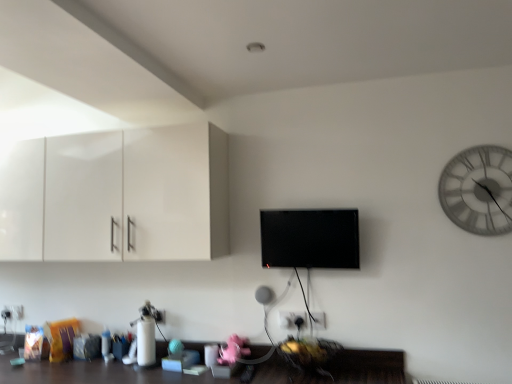
Describe the element at coordinates (310, 238) in the screenshot. The image size is (512, 384). I see `black glossy flat screen tv at center` at that location.

You are a GUI agent. You are given a task and a screenshot of the screen. Output one action in this format:
    pyautogui.click(x=<x>, y=<y>)
    Task: Click on the white glass clock at upper right
    The width and height of the screenshot is (512, 384).
    Given the screenshot: What is the action you would take?
    pyautogui.click(x=479, y=190)

Measure the distance between white plastic electric outlet at lower center, which is counted as the 1th electric outlet, starting from the top, and camera.

white plastic electric outlet at lower center, which is counted as the 1th electric outlet, starting from the top, and camera are 2.29 meters apart.

Where is `white plastic electric outlet at lower left, placed as the 2th electric outlet when sorted from front to back`? white plastic electric outlet at lower left, placed as the 2th electric outlet when sorted from front to back is located at coordinates (13, 312).

Where is `white glossy cabinet at upper left`? white glossy cabinet at upper left is located at coordinates (117, 196).

Where is `black glossy flat screen tv at center`? black glossy flat screen tv at center is located at coordinates (310, 238).

Which of these two, white plastic electric outlet at lower left, which appears as the first electric outlet when viewed from the left, or black glossy flat screen tv at center, stands shorter?

white plastic electric outlet at lower left, which appears as the first electric outlet when viewed from the left.

Is white plastic electric outlet at lower left, acting as the second electric outlet starting from the top, thinner than black glossy flat screen tv at center?

Yes.

From the image's perspective, which one is positioned higher, white plastic electric outlet at lower left, placed as the 2th electric outlet when sorted from front to back, or black glossy flat screen tv at center?

black glossy flat screen tv at center, from the image's perspective.

In terms of size, does white plastic electric outlet at lower center, which is counted as the 1th electric outlet, starting from the top, appear bigger or smaller than black glossy flat screen tv at center?

Clearly, white plastic electric outlet at lower center, which is counted as the 1th electric outlet, starting from the top, is smaller in size than black glossy flat screen tv at center.

Is black glossy flat screen tv at center completely or partially inside white plastic electric outlet at lower center, which is the 2th electric outlet in left-to-right order?

No, black glossy flat screen tv at center is located outside of white plastic electric outlet at lower center, which is the 2th electric outlet in left-to-right order.

Is white plastic electric outlet at lower center, the first electric outlet when ordered from right to left, oriented away from black glossy flat screen tv at center?

No, white plastic electric outlet at lower center, the first electric outlet when ordered from right to left, is not facing the opposite direction of black glossy flat screen tv at center.

In terms of width, does white plastic electric outlet at lower center, the first electric outlet when ordered from right to left, look wider or thinner when compared to black glossy flat screen tv at center?

Considering their sizes, white plastic electric outlet at lower center, the first electric outlet when ordered from right to left, looks slimmer than black glossy flat screen tv at center.

Which is behind, point (302, 231) or point (9, 306)?

The point (9, 306) is behind.

Is black glossy flat screen tv at center next to white plastic electric outlet at lower left, which appears as the first electric outlet when viewed from the left?

No, black glossy flat screen tv at center is not beside white plastic electric outlet at lower left, which appears as the first electric outlet when viewed from the left.

Which is behind, black glossy flat screen tv at center or white plastic electric outlet at lower left, which appears as the first electric outlet when viewed from the left?

white plastic electric outlet at lower left, which appears as the first electric outlet when viewed from the left, is more distant.

From the image's perspective, which one is positioned lower, black glossy flat screen tv at center or white plastic electric outlet at lower left, acting as the second electric outlet starting from the top?

From the image's view, white plastic electric outlet at lower left, acting as the second electric outlet starting from the top, is below.

From a real-world perspective, is white plastic electric outlet at lower center, placed as the second electric outlet when sorted from back to front, located higher than white glossy cabinet at upper left?

No.

In the scene shown: From the image's perspective, is white plastic electric outlet at lower center, which is counted as the 1th electric outlet, starting from the top, on white glossy cabinet at upper left?

Incorrect, from the image's perspective, white plastic electric outlet at lower center, which is counted as the 1th electric outlet, starting from the top, is lower than white glossy cabinet at upper left.

Image resolution: width=512 pixels, height=384 pixels. In order to click on cabinetry above the white plastic electric outlet at lower center, the 2th electric outlet ordered from the bottom (from the image's perspective) in this screenshot , I will do `click(117, 196)`.

Consider the image. Which is more to the left, white glass clock at upper right or white glossy cabinet at upper left?

white glossy cabinet at upper left.

From a real-world perspective, which object stands above the other?

In real-world perspective, white glossy cabinet at upper left is above.

Considering the sizes of objects white glass clock at upper right and white glossy cabinet at upper left in the image provided, who is smaller, white glass clock at upper right or white glossy cabinet at upper left?

white glass clock at upper right.

Is white glossy cabinet at upper left located within white glass clock at upper right?

No.

Measure the distance between white glossy cabinet at upper left and white plastic electric outlet at lower center, which is counted as the 1th electric outlet, starting from the front.

A distance of 4.34 feet exists between white glossy cabinet at upper left and white plastic electric outlet at lower center, which is counted as the 1th electric outlet, starting from the front.

Is white plastic electric outlet at lower center, placed as the second electric outlet when sorted from back to front, at the back of white glossy cabinet at upper left?

No, white plastic electric outlet at lower center, placed as the second electric outlet when sorted from back to front, is not at the back of white glossy cabinet at upper left.

Image resolution: width=512 pixels, height=384 pixels. Find the location of `the 1st electric outlet behind the white glossy cabinet at upper left, counting from the anchor's position`. the 1st electric outlet behind the white glossy cabinet at upper left, counting from the anchor's position is located at coordinates (319, 321).

Based on the photo, which is more to the right, white glossy cabinet at upper left or white plastic electric outlet at lower center, the 2th electric outlet ordered from the bottom?

white plastic electric outlet at lower center, the 2th electric outlet ordered from the bottom, is more to the right.

From a real-world perspective, is white plastic electric outlet at lower left, acting as the second electric outlet starting from the top, physically below white glass clock at upper right?

Yes, from a real-world perspective, white plastic electric outlet at lower left, acting as the second electric outlet starting from the top, is below white glass clock at upper right.

Which object is more forward, white plastic electric outlet at lower left, which appears as the first electric outlet when viewed from the left, or white glass clock at upper right?

white glass clock at upper right.

You are a GUI agent. You are given a task and a screenshot of the screen. Output one action in this format:
    pyautogui.click(x=<x>, y=<y>)
    Task: Click on the electric outlet that is the 2nd one when counting leftward from the white glass clock at upper right
    The image size is (512, 384).
    Given the screenshot: What is the action you would take?
    pyautogui.click(x=13, y=312)

Considering the relative positions of white plastic electric outlet at lower left, which ranks as the first electric outlet in bottom-to-top order, and white glass clock at upper right in the image provided, is white plastic electric outlet at lower left, which ranks as the first electric outlet in bottom-to-top order, to the left or to the right of white glass clock at upper right?

white plastic electric outlet at lower left, which ranks as the first electric outlet in bottom-to-top order, is positioned on white glass clock at upper right's left side.

Locate an element on the screen. This screenshot has height=384, width=512. flat that appears above the white plastic electric outlet at lower left, which ranks as the first electric outlet in bottom-to-top order (from the image's perspective) is located at coordinates (310, 238).

Where is `flat on the left of white plastic electric outlet at lower center, which is counted as the 1th electric outlet, starting from the top`? flat on the left of white plastic electric outlet at lower center, which is counted as the 1th electric outlet, starting from the top is located at coordinates (310, 238).

When comparing their distances from white plastic electric outlet at lower center, placed as the second electric outlet when sorted from back to front, does white glass clock at upper right or white plastic electric outlet at lower left, placed as the 2th electric outlet when sorted from front to back, seem further?

white plastic electric outlet at lower left, placed as the 2th electric outlet when sorted from front to back, lies further to white plastic electric outlet at lower center, placed as the second electric outlet when sorted from back to front, than the other object.

Which object lies further to the anchor point white plastic electric outlet at lower center, which is counted as the 1th electric outlet, starting from the front, white glass clock at upper right or white glossy cabinet at upper left?

white glossy cabinet at upper left is further to white plastic electric outlet at lower center, which is counted as the 1th electric outlet, starting from the front.

From the image, which object appears to be nearer to white glass clock at upper right, black glossy flat screen tv at center or white plastic electric outlet at lower center, which is counted as the 1th electric outlet, starting from the front?

black glossy flat screen tv at center lies closer to white glass clock at upper right than the other object.

Which object lies nearer to the anchor point white plastic electric outlet at lower center, placed as the second electric outlet when sorted from back to front, white plastic electric outlet at lower left, acting as the second electric outlet starting from the top, or white glossy cabinet at upper left?

Among the two, white glossy cabinet at upper left is located nearer to white plastic electric outlet at lower center, placed as the second electric outlet when sorted from back to front.

Looking at this image, which object lies further to the anchor point white plastic electric outlet at lower center, which is counted as the 1th electric outlet, starting from the front, white plastic electric outlet at lower left, which appears as the first electric outlet when viewed from the left, or black glossy flat screen tv at center?

The object further to white plastic electric outlet at lower center, which is counted as the 1th electric outlet, starting from the front, is white plastic electric outlet at lower left, which appears as the first electric outlet when viewed from the left.

When comparing their distances from white glass clock at upper right, does white plastic electric outlet at lower center, placed as the second electric outlet when sorted from back to front, or white glossy cabinet at upper left seem further?

Based on the image, white glossy cabinet at upper left appears to be further to white glass clock at upper right.

Estimate the real-world distances between objects in this image. Which object is closer to black glossy flat screen tv at center, white plastic electric outlet at lower left, which appears as the first electric outlet when viewed from the left, or white plastic electric outlet at lower center, placed as the second electric outlet when sorted from back to front?

white plastic electric outlet at lower center, placed as the second electric outlet when sorted from back to front, is positioned closer to the anchor black glossy flat screen tv at center.

Which object lies nearer to the anchor point white plastic electric outlet at lower center, the first electric outlet when ordered from right to left, black glossy flat screen tv at center or white glass clock at upper right?

Based on the image, black glossy flat screen tv at center appears to be nearer to white plastic electric outlet at lower center, the first electric outlet when ordered from right to left.

At what (x,y) coordinates should I click in order to perform the action: click on electric outlet situated between white plastic electric outlet at lower left, acting as the 1th electric outlet starting from the back, and white glass clock at upper right from left to right. Please return your answer as a coordinate pair (x, y). Image resolution: width=512 pixels, height=384 pixels. Looking at the image, I should click on (319, 321).

Where is `flat located between white glossy cabinet at upper left and white plastic electric outlet at lower center, the 2th electric outlet ordered from the bottom, in the left-right direction`? The height and width of the screenshot is (384, 512). flat located between white glossy cabinet at upper left and white plastic electric outlet at lower center, the 2th electric outlet ordered from the bottom, in the left-right direction is located at coordinates [310, 238].

You are a GUI agent. You are given a task and a screenshot of the screen. Output one action in this format:
    pyautogui.click(x=<x>, y=<y>)
    Task: Click on the cabinetry between white plastic electric outlet at lower left, acting as the second electric outlet starting from the top, and white plastic electric outlet at lower center, the first electric outlet when ordered from right to left, in the horizontal direction
    This screenshot has width=512, height=384.
    Given the screenshot: What is the action you would take?
    pyautogui.click(x=117, y=196)

The image size is (512, 384). Find the location of `flat between white glossy cabinet at upper left and white glass clock at upper right`. flat between white glossy cabinet at upper left and white glass clock at upper right is located at coordinates (310, 238).